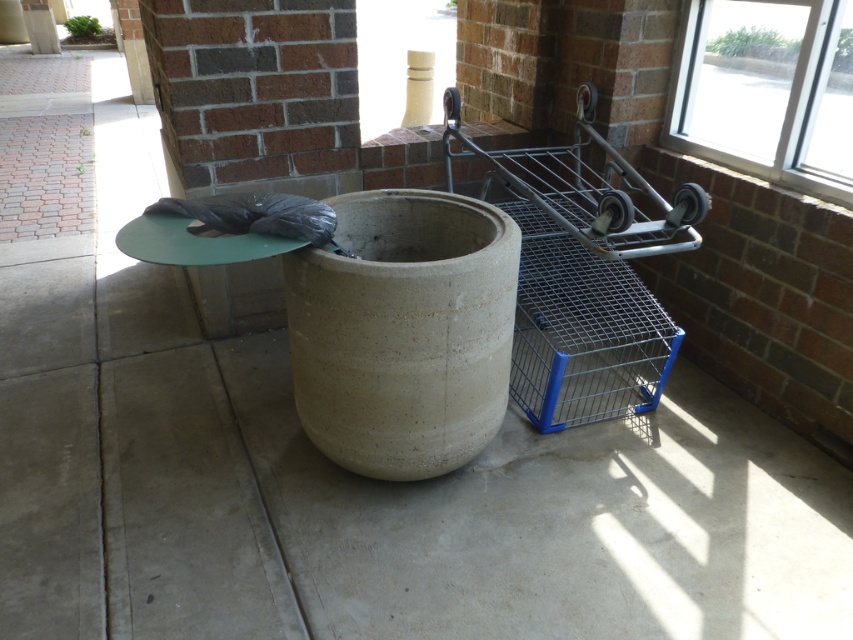
Question: Is beige concrete barrel at center positioned in front of transparent glass window at upper right?

Choices:
 (A) yes
 (B) no

Answer: (A)

Question: Estimate the real-world distances between objects in this image. Which object is closer to the metallic wire cart at right?

Choices:
 (A) beige concrete barrel at center
 (B) transparent glass window at upper right

Answer: (B)

Question: Does metallic wire cart at right come in front of transparent glass window at upper right?

Choices:
 (A) no
 (B) yes

Answer: (B)

Question: Which of the following is the farthest from the observer?

Choices:
 (A) (550, 170)
 (B) (364, 216)
 (C) (851, 179)

Answer: (A)

Question: Which of these objects is positioned closest to the transparent glass window at upper right?

Choices:
 (A) metallic wire cart at right
 (B) beige concrete barrel at center

Answer: (A)

Question: Can you confirm if beige concrete barrel at center is positioned below transparent glass window at upper right?

Choices:
 (A) yes
 (B) no

Answer: (A)